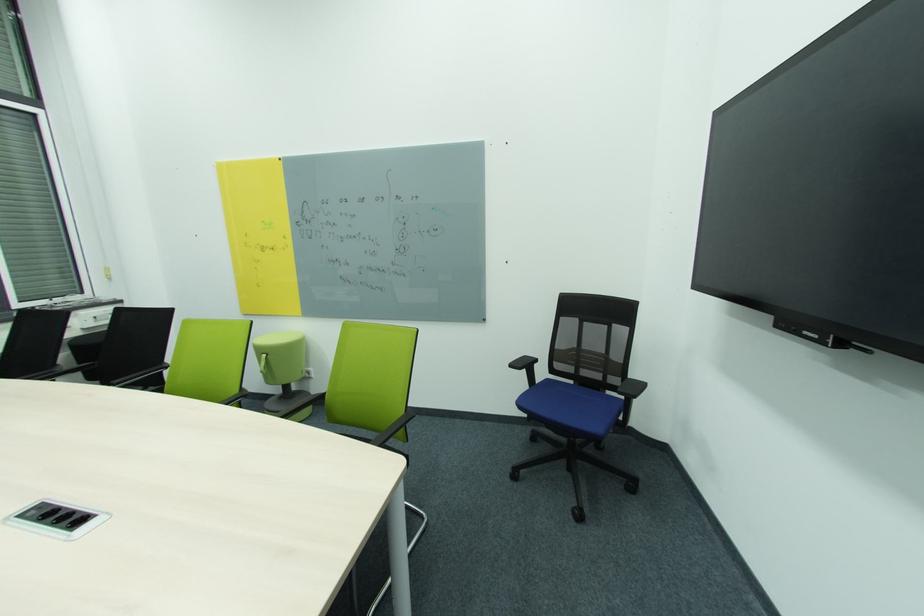
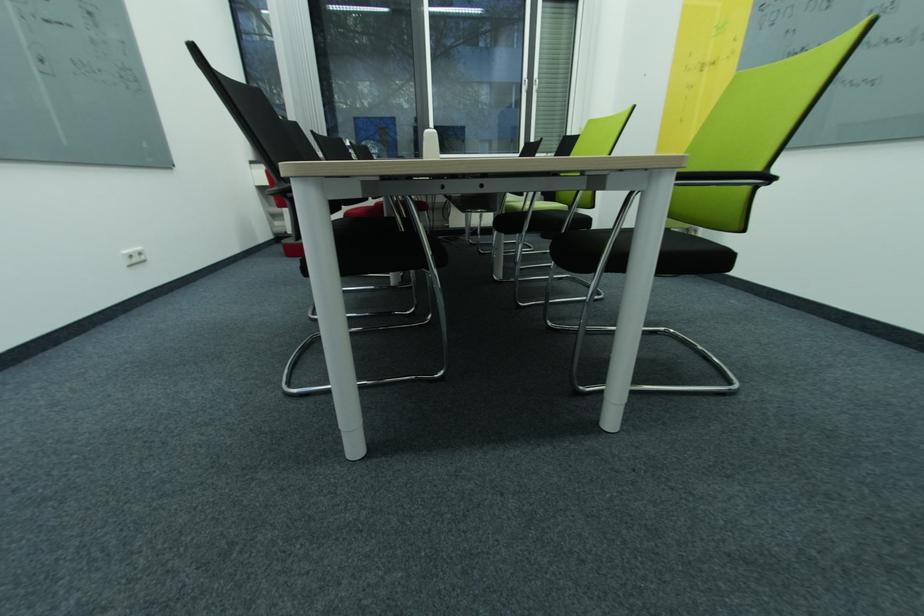
Based on the continuous images, in which direction is the camera rotating?

The camera's rotation is toward left-down.